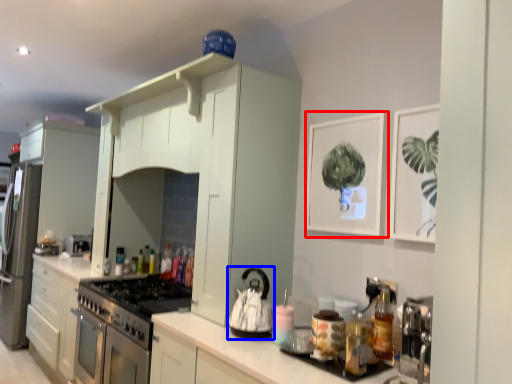
Question: Which of the following is the closest to the observer, picture frame (highlighted by a red box) or kitchen appliance (highlighted by a blue box)?

Choices:
 (A) picture frame
 (B) kitchen appliance

Answer: (B)